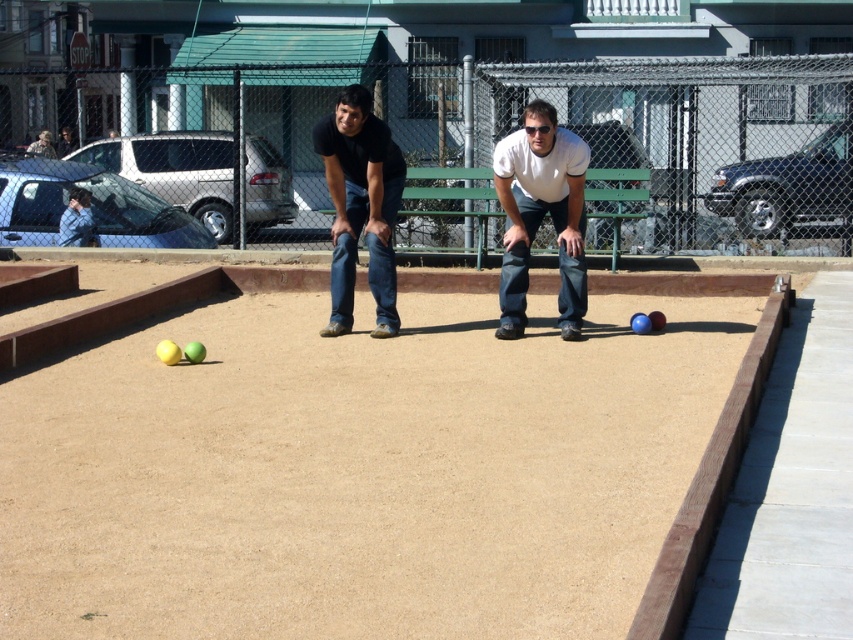
You are a photographer at the edge of the bocce ball court. You want to take a photo of the white matte shirt at center and the black matte jeans at center without any obstructions. Based on their positions, can you capture both subjects in the same frame without one blocking the other?

The white matte shirt at center is in front of the black matte jeans at center, so the white matte shirt at center would block the view of the black matte jeans at center. To capture both without obstruction, you would need to adjust their positions or angle the camera so that they are side by side rather than one in front of the other.

You are standing at the edge of a bocce ball court and see the white matte shirt at center. If you want to throw a ball to hit the shirt, will you need to throw it more than 10 meters?

The white matte shirt at center is 9.58 meters from viewer, so you do not need to throw the ball more than 10 meters.